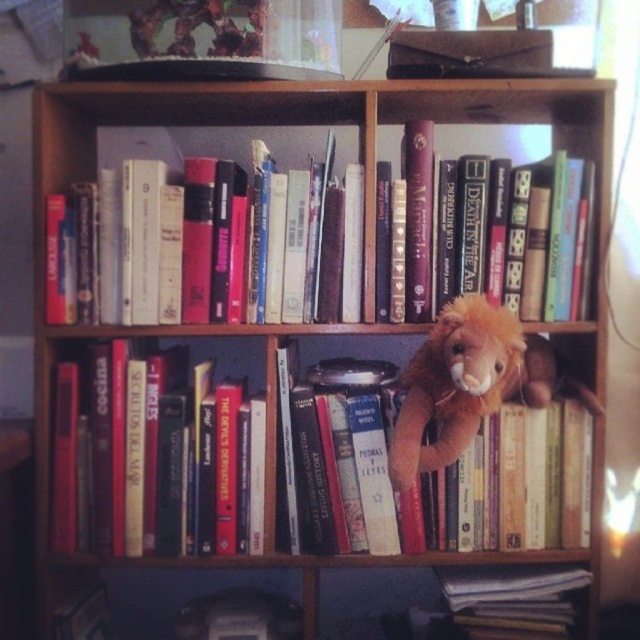
In the scene shown: Is hardcover books at left wider than hardcover books at center?

Incorrect, hardcover books at left's width does not surpass hardcover books at center's.

Based on the photo, is hardcover books at left smaller than hardcover books at center?

Correct, hardcover books at left occupies less space than hardcover books at center.

This screenshot has width=640, height=640. What do you see at coordinates (122, 449) in the screenshot? I see `hardcover books at left` at bounding box center [122, 449].

Where is `hardcover books at left`? This screenshot has height=640, width=640. hardcover books at left is located at coordinates (122, 449).

Between point (401, 438) and point (333, 550), which one is positioned in front?

Point (401, 438) is more forward.

Does brown plush toy at center-right have a lesser height compared to soft brown plush toy at center?

Yes, brown plush toy at center-right is shorter than soft brown plush toy at center.

Find the location of a particular element. The width and height of the screenshot is (640, 640). brown plush toy at center-right is located at coordinates (472, 381).

Find the location of a particular element. brown plush toy at center-right is located at coordinates (472, 381).

How far apart are hardcover books at center and hardcover book at lower right?

They are 27.81 inches apart.

Which is below, hardcover books at center or hardcover book at lower right?

hardcover book at lower right is below.

Where is `hardcover books at center`? The image size is (640, 640). hardcover books at center is located at coordinates (218, 147).

Identify the location of hardcover books at center. [218, 147].